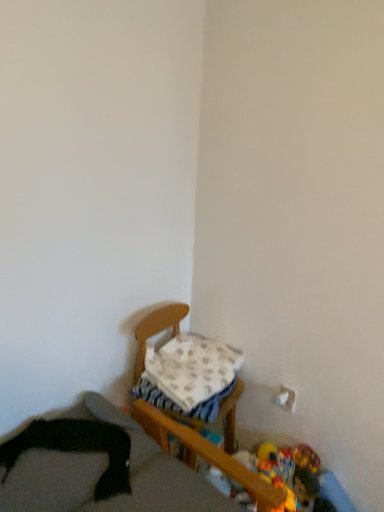
Question: From the image's perspective, is plush yellow duck at lower right, which is counted as the first toy, starting from the right, on plush yellow duck at lower right, which ranks as the first toy in left-to-right order?

Choices:
 (A) no
 (B) yes

Answer: (B)

Question: Can you confirm if plush yellow duck at lower right, the third toy when ordered from left to right, is thinner than plush yellow duck at lower right, which ranks as the first toy in left-to-right order?

Choices:
 (A) yes
 (B) no

Answer: (A)

Question: Does plush yellow duck at lower right, which is counted as the first toy, starting from the right, come in front of plush yellow duck at lower right, the 3th toy in the right-to-left sequence?

Choices:
 (A) no
 (B) yes

Answer: (A)

Question: Is plush yellow duck at lower right, the third toy when ordered from left to right, wider than plush yellow duck at lower right, the 3th toy in the right-to-left sequence?

Choices:
 (A) no
 (B) yes

Answer: (A)

Question: Is plush yellow duck at lower right, the third toy when ordered from left to right, at the left side of plush yellow duck at lower right, the 3th toy in the right-to-left sequence?

Choices:
 (A) no
 (B) yes

Answer: (A)

Question: In the image, is plush multicolored toy at lower right, which is the 2th toy from left to right, positioned in front of or behind wooden chair at center, which appears as the first furniture when viewed from the back?

Choices:
 (A) behind
 (B) front

Answer: (A)

Question: Considering the positions of point (279, 463) and point (158, 311), is point (279, 463) closer or farther from the camera than point (158, 311)?

Choices:
 (A) closer
 (B) farther

Answer: (A)

Question: Considering the positions of plush multicolored toy at lower right, positioned as the 2th toy in right-to-left order, and wooden chair at center, the second furniture viewed from the front, in the image, is plush multicolored toy at lower right, positioned as the 2th toy in right-to-left order, wider or thinner than wooden chair at center, the second furniture viewed from the front,?

Choices:
 (A) wide
 (B) thin

Answer: (B)

Question: From their relative heights in the image, would you say plush multicolored toy at lower right, which is the 2th toy from left to right, is taller or shorter than wooden chair at center, the second furniture viewed from the front?

Choices:
 (A) short
 (B) tall

Answer: (A)

Question: Is plush yellow duck at lower right, which is counted as the first toy, starting from the right, wider or thinner than plush yellow duck at lower right, which ranks as the first toy in left-to-right order?

Choices:
 (A) thin
 (B) wide

Answer: (A)

Question: Is plush yellow duck at lower right, which is counted as the first toy, starting from the right, inside the boundaries of plush yellow duck at lower right, which ranks as the first toy in left-to-right order, or outside?

Choices:
 (A) outside
 (B) inside

Answer: (A)

Question: Based on their sizes in the image, would you say plush yellow duck at lower right, which is counted as the first toy, starting from the right, is bigger or smaller than plush yellow duck at lower right, which ranks as the first toy in left-to-right order?

Choices:
 (A) small
 (B) big

Answer: (B)

Question: Considering the relative positions of plush yellow duck at lower right, which is counted as the first toy, starting from the right, and plush yellow duck at lower right, which ranks as the first toy in left-to-right order, in the image provided, is plush yellow duck at lower right, which is counted as the first toy, starting from the right, to the left or to the right of plush yellow duck at lower right, which ranks as the first toy in left-to-right order,?

Choices:
 (A) right
 (B) left

Answer: (A)

Question: From a real-world perspective, is plush yellow duck at lower right, which ranks as the first toy in left-to-right order, above or below plush multicolored toy at lower right, positioned as the 2th toy in right-to-left order?

Choices:
 (A) above
 (B) below

Answer: (B)

Question: Considering their positions, is plush yellow duck at lower right, the 3th toy in the right-to-left sequence, located in front of or behind plush multicolored toy at lower right, positioned as the 2th toy in right-to-left order?

Choices:
 (A) behind
 (B) front

Answer: (B)